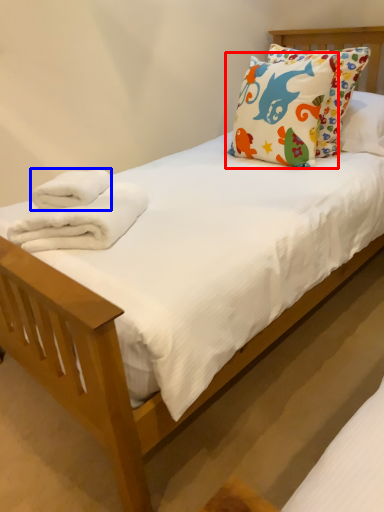
Question: Which object appears closest to the camera in this image, pillow (highlighted by a red box) or bath towel (highlighted by a blue box)?

Choices:
 (A) pillow
 (B) bath towel

Answer: (B)